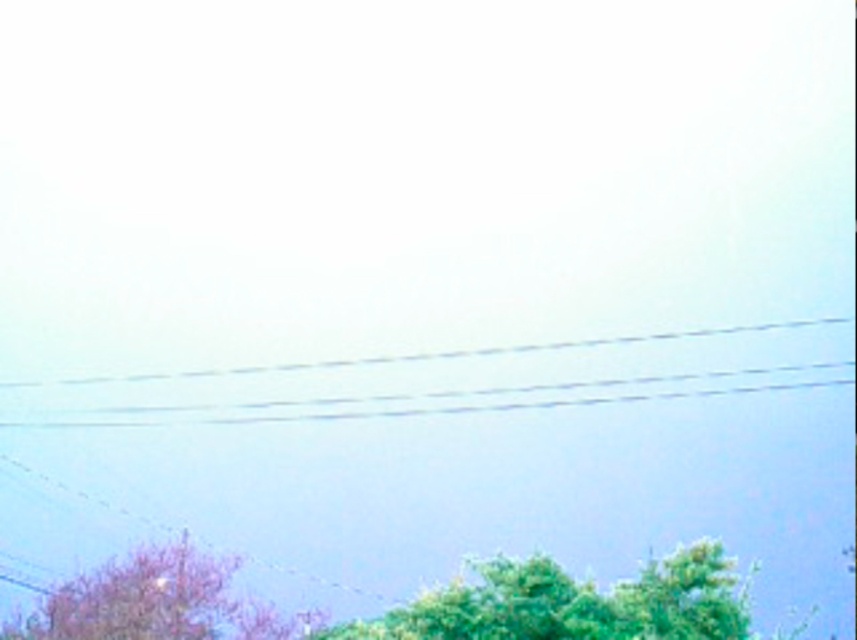
You are standing in a field and looking at the clear plastic power lines at center and the green leafy tree at lower center. Which object is closer to your eyes?

The clear plastic power lines at center are closer to your eyes because they are further to the viewer than the green leafy tree at lower center.

You are standing in a field looking at the two points in the scene. Which point, point (780, 342) or point (78, 580), is closer to you?

Point (780, 342) is closer to you because it is further to the camera than point (78, 580).

You are a photographer trying to capture a clear shot of the pink matte tree at lower left without the clear plastic power lines at center obstructing it. Based on the scene, is it possible to adjust your position so that the power lines are no longer visible in the frame?

The clear plastic power lines at center are located above the pink matte tree at lower left, so by moving your position to the left or right, you can shift the angle and potentially frame the shot so the power lines are no longer in the same plane as the tree, thus avoiding obstruction.